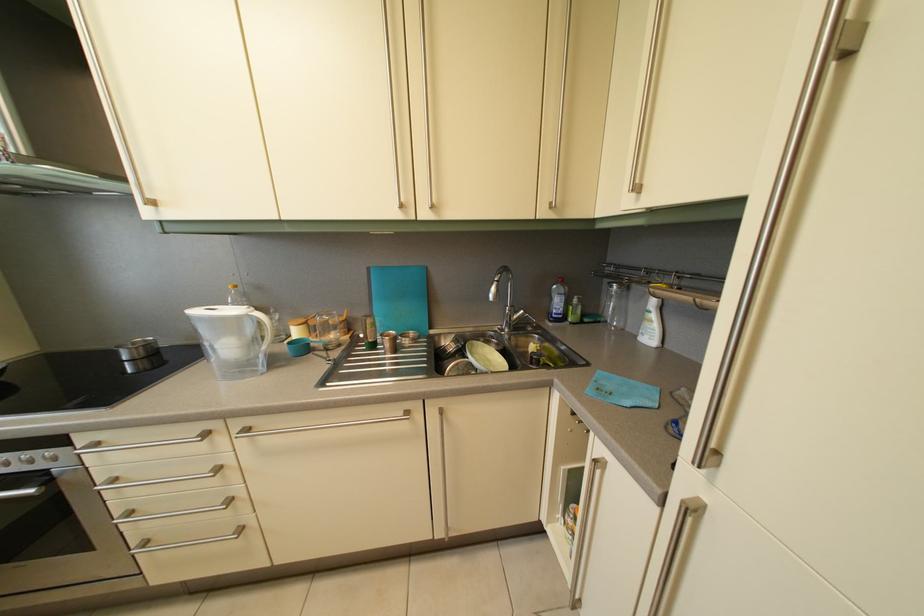
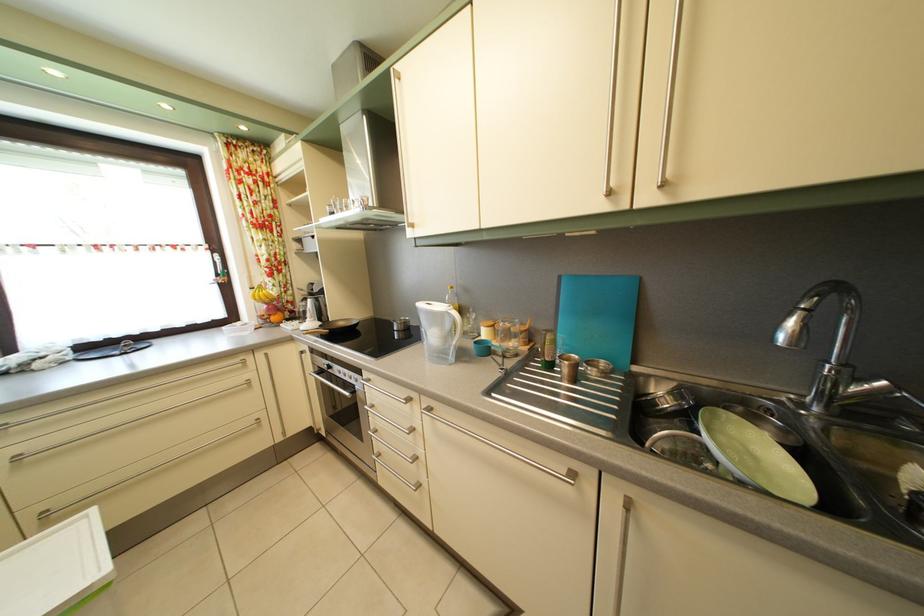
The point at [173,351] is marked in the first image. Where is the corresponding point in the second image?

(420, 331)